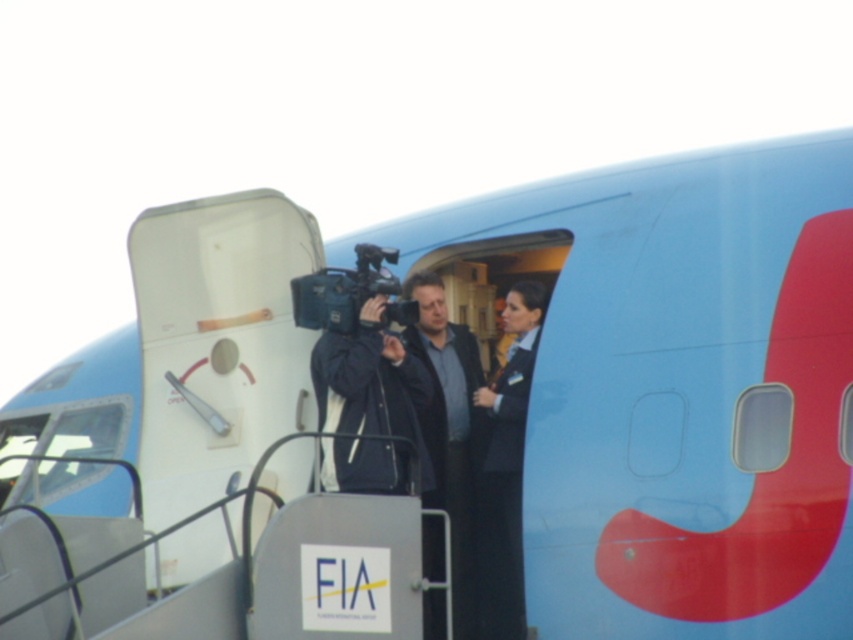
You are a photographer standing at the airport scene described. You need to capture a photo of the individual in the black fabric uniform at center while ensuring the matte black video camera at center is also in the frame. Given their distance apart, can you fit both subjects into your camera frame without moving your position?

The black fabric uniform at center and matte black video camera at center are 5.03 meters apart. Depending on your camera lens, if it has a wide enough angle or zoom setting to encompass 5.03 meters between them, both can be captured in the same frame. However, if your lens doesn

You are a photographer at the airport scene described. You need to capture a closeup shot of the person in the black fabric uniform at center while also including the matte black video camera at center in the frame. Given their sizes, will the camera fit in the shot if you focus on the uniform?

The black fabric uniform at center is larger than the matte black video camera at center. Therefore, if you focus on capturing the uniform in a closeup, the matte black video camera at center may not fit entirely within the same frame due to its smaller size relative to the uniform.

You are standing at the airport and want to take a photo of both the point at coordinates point [445,493] and point [347,330]. Which point should you focus on first to ensure both are in focus?

You should focus on point [347,330] first because it is closer to you than point [445,493], which is further away. This way, the depth of field will likely include both points when focused on the closer one.